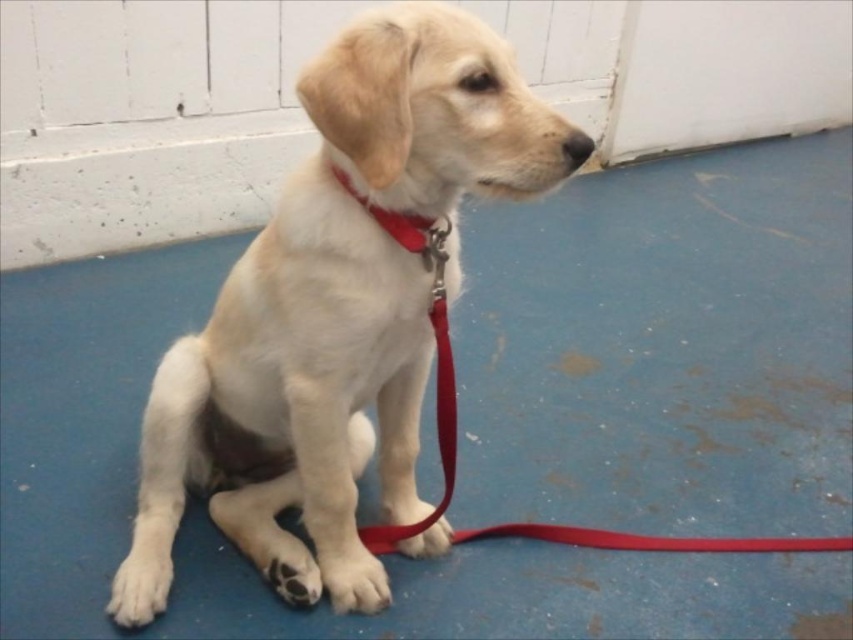
The scene shows a white fur dog at center and a matte nylon collar at center. Which object occupies more space horizontally in the image?

The white fur dog at center occupies more horizontal space than the matte nylon collar at center because its width is larger than the collar.

You are a dog trainer observing the scene. You notice the white fur dog at center and the matte nylon collar at center. Which object is positioned closer to your viewpoint?

The white fur dog at center is closer to the viewer than the matte nylon collar at center.

You are a dog trainer observing the scene. The white fur dog at center is wearing the red leather leash at center. Based on their positions, can you determine if the leash is currently attached to the dog?

The white fur dog at center is above the red leather leash at center, which means the leash is likely attached to the dog since it is positioned below the dog.